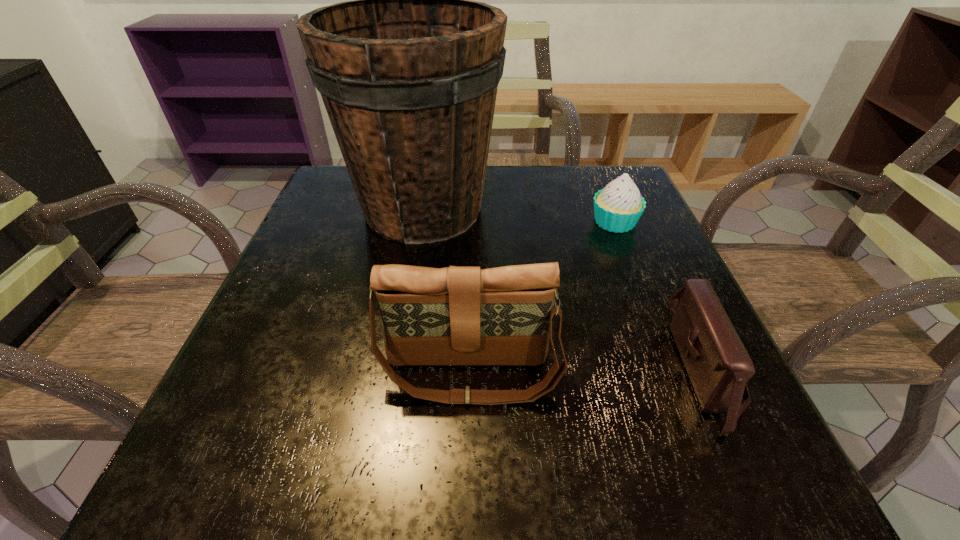
Locate an element on the screen. The height and width of the screenshot is (540, 960). bucket is located at coordinates (408, 72).

The width and height of the screenshot is (960, 540). What are the coordinates of `the third shortest object` in the screenshot? It's located at (455, 315).

I want to click on the left shoulder bag, so click(x=455, y=315).

Where is `cupcake`? This screenshot has height=540, width=960. cupcake is located at coordinates (617, 208).

Locate an element on the screen. Image resolution: width=960 pixels, height=540 pixels. the right shoulder bag is located at coordinates (718, 365).

Find the location of a particular element. Image resolution: width=960 pixels, height=540 pixels. free region located 0.230m on the front of the bucket is located at coordinates (398, 352).

You are a GUI agent. You are given a task and a screenshot of the screen. Output one action in this format:
    pyautogui.click(x=<x>, y=<y>)
    Task: Click on the vacant region located on the front-facing side of the left shoulder bag
    
    Given the screenshot: What is the action you would take?
    pyautogui.click(x=468, y=441)

Locate an element on the screen. free space located 0.250m on the left of the cupcake is located at coordinates (474, 222).

You are a GUI agent. You are given a task and a screenshot of the screen. Output one action in this format:
    pyautogui.click(x=<x>, y=<y>)
    Task: Click on the vacant space located on the front flap of the right shoulder bag
    This screenshot has width=960, height=540.
    Given the screenshot: What is the action you would take?
    pyautogui.click(x=592, y=369)

Where is `free space located 0.150m on the front flap of the right shoulder bag`? The width and height of the screenshot is (960, 540). free space located 0.150m on the front flap of the right shoulder bag is located at coordinates (579, 369).